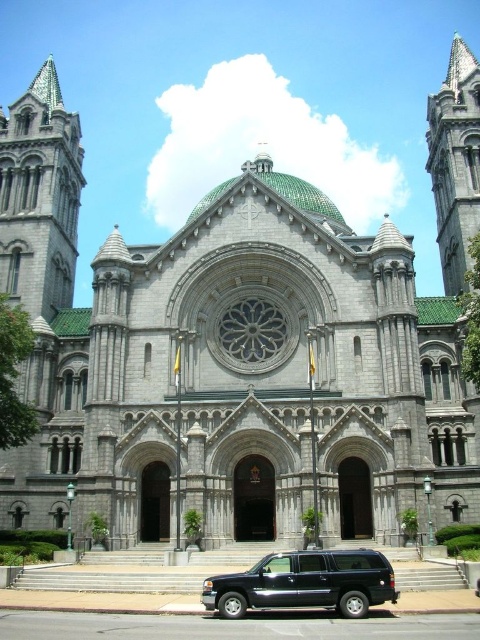
Can you confirm if gray stone tower at upper right is positioned to the left of black matte suv at lower center?

Incorrect, gray stone tower at upper right is not on the left side of black matte suv at lower center.

The height and width of the screenshot is (640, 480). Describe the element at coordinates (455, 161) in the screenshot. I see `gray stone tower at upper right` at that location.

Does point (440, 150) lie in front of point (343, 576)?

No.

Image resolution: width=480 pixels, height=640 pixels. Identify the location of gray stone tower at upper right. (455, 161).